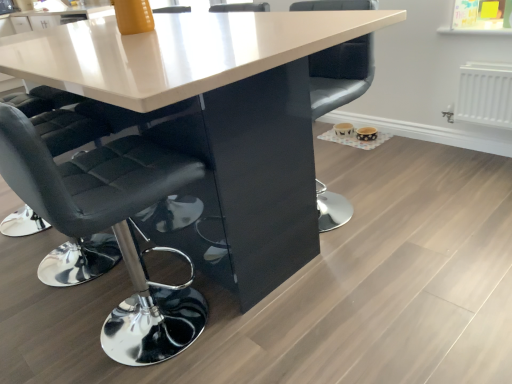
Question: Does white glossy table at center have a larger size compared to black leather chair at center, arranged as the first chair when viewed from the right?

Choices:
 (A) no
 (B) yes

Answer: (B)

Question: Is white glossy table at center shorter than black leather chair at center, which is the second chair in left-to-right order?

Choices:
 (A) yes
 (B) no

Answer: (B)

Question: Is white glossy table at center oriented towards black leather chair at center, which is the second chair in left-to-right order?

Choices:
 (A) no
 (B) yes

Answer: (A)

Question: Is white glossy table at center wider than black leather chair at center, which is the second chair in left-to-right order?

Choices:
 (A) yes
 (B) no

Answer: (A)

Question: Is there a large distance between white glossy table at center and black leather chair at center, which is the second chair in left-to-right order?

Choices:
 (A) no
 (B) yes

Answer: (A)

Question: From a real-world perspective, relative to white glossy table at center, is black leather chair at center, which is the second chair in left-to-right order, vertically above or below?

Choices:
 (A) above
 (B) below

Answer: (A)

Question: In terms of height, does black leather chair at center, arranged as the first chair when viewed from the right, look taller or shorter compared to white glossy table at center?

Choices:
 (A) tall
 (B) short

Answer: (B)

Question: Is black leather chair at center, arranged as the first chair when viewed from the right, spatially inside white glossy table at center, or outside of it?

Choices:
 (A) outside
 (B) inside

Answer: (B)

Question: From the image's perspective, is black leather chair at center, which is the second chair in left-to-right order, above or below white glossy table at center?

Choices:
 (A) below
 (B) above

Answer: (B)

Question: From the image's perspective, is black leather chair at center, arranged as the first chair when viewed from the right, located above or below black leather chair at left, acting as the second chair starting from the right?

Choices:
 (A) below
 (B) above

Answer: (B)

Question: From a real-world perspective, is black leather chair at center, arranged as the first chair when viewed from the right, positioned above or below black leather chair at left, acting as the second chair starting from the right?

Choices:
 (A) above
 (B) below

Answer: (B)

Question: Looking at their shapes, would you say black leather chair at center, arranged as the first chair when viewed from the right, is wider or thinner than black leather chair at left, acting as the second chair starting from the right?

Choices:
 (A) wide
 (B) thin

Answer: (B)

Question: Is black leather chair at center, which is the second chair in left-to-right order, inside or outside of black leather chair at left, which appears as the 1th chair when viewed from the left?

Choices:
 (A) inside
 (B) outside

Answer: (B)

Question: In terms of width, does black leather chair at left, acting as the second chair starting from the right, look wider or thinner when compared to black leather chair at center, which is the second chair in left-to-right order?

Choices:
 (A) wide
 (B) thin

Answer: (A)

Question: Considering the relative positions of black leather chair at left, acting as the second chair starting from the right, and black leather chair at center, which is the second chair in left-to-right order, in the image provided, is black leather chair at left, acting as the second chair starting from the right, to the left or to the right of black leather chair at center, which is the second chair in left-to-right order,?

Choices:
 (A) left
 (B) right

Answer: (A)